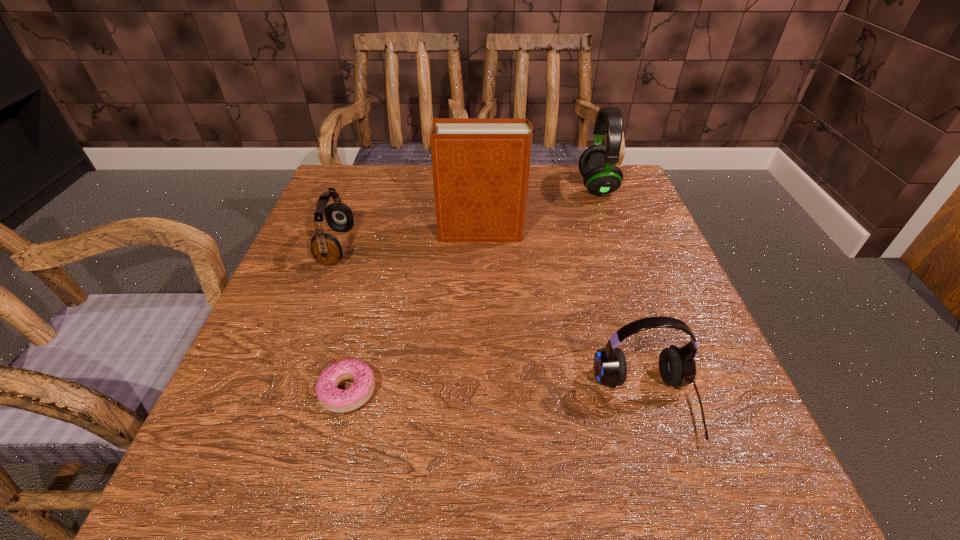
At what (x,y) coordinates should I click in order to perform the action: click on vacant space at the far right corner of the desktop. Please return your answer as a coordinate pair (x, y). Looking at the image, I should click on (597, 201).

In order to click on vacant space at the near right corner of the desktop in this screenshot , I will do `click(698, 484)`.

Find the location of a particular element. free space between the second farthest headset and the tallest object is located at coordinates (409, 239).

The height and width of the screenshot is (540, 960). I want to click on free space that is in between the second object from left to right and the leftmost object, so click(343, 319).

At what (x,y) coordinates should I click in order to perform the action: click on vacant point located between the third object from right to left and the farthest headset. Please return your answer as a coordinate pair (x, y). The height and width of the screenshot is (540, 960). Looking at the image, I should click on (540, 210).

The height and width of the screenshot is (540, 960). What are the coordinates of `free space between the second nearest headset and the tallest object` in the screenshot? It's located at (409, 239).

Locate an element on the screen. This screenshot has width=960, height=540. vacant region between the second nearest headset and the nearest headset is located at coordinates (492, 324).

Locate an element on the screen. Image resolution: width=960 pixels, height=540 pixels. vacant area between the doughnut and the leftmost headset is located at coordinates (343, 319).

The height and width of the screenshot is (540, 960). In order to click on unoccupied area between the second tallest object and the nearest headset in this screenshot , I will do `click(622, 294)`.

Find the location of a particular element. The width and height of the screenshot is (960, 540). free space between the hardback book and the tallest headset is located at coordinates (x=540, y=210).